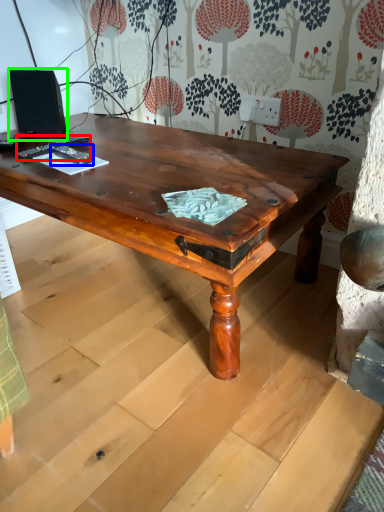
Question: Considering the real-world distances, which object is farthest from remote control (highlighted by a red box)? remote control (highlighted by a blue box) or speaker (highlighted by a green box)?

Choices:
 (A) remote control
 (B) speaker

Answer: (B)